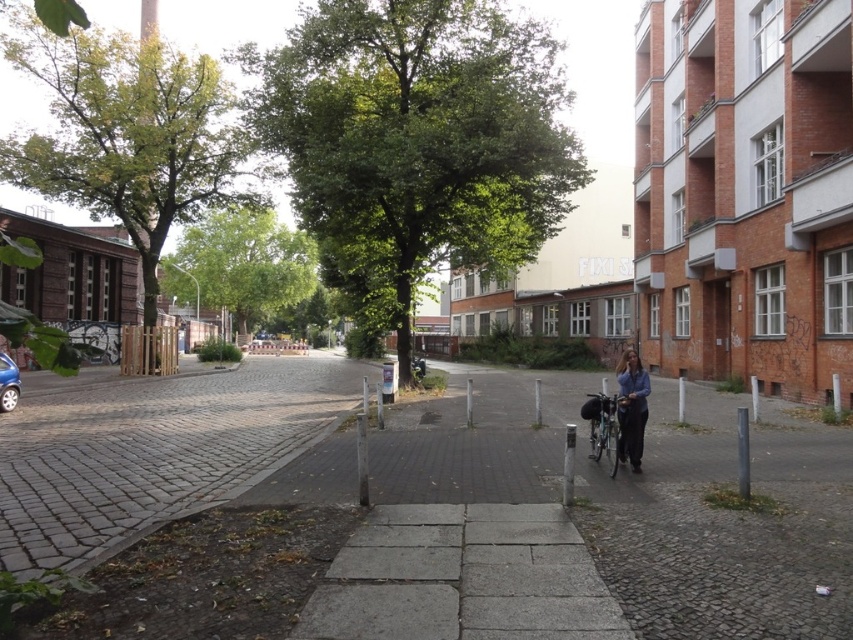
The image size is (853, 640). What do you see at coordinates (437, 506) in the screenshot? I see `gray concrete pavement at center` at bounding box center [437, 506].

Is gray concrete pavement at center smaller than blue denim jacket at lower right?

Incorrect, gray concrete pavement at center is not smaller in size than blue denim jacket at lower right.

Image resolution: width=853 pixels, height=640 pixels. I want to click on gray concrete pavement at center, so click(x=437, y=506).

Does gray concrete pavement at center have a greater height compared to shiny metallic bicycle at center?

In fact, gray concrete pavement at center may be shorter than shiny metallic bicycle at center.

Is point (399, 500) farther from viewer compared to point (610, 403)?

That is False.

I want to click on gray concrete pavement at center, so click(437, 506).

Where is `gray concrete pavement at center`? This screenshot has width=853, height=640. gray concrete pavement at center is located at coordinates (437, 506).

Who is more forward, (647, 381) or (614, 412)?

Point (614, 412)

I want to click on blue denim jacket at lower right, so click(631, 406).

What do you see at coordinates (631, 406) in the screenshot? I see `blue denim jacket at lower right` at bounding box center [631, 406].

The image size is (853, 640). Identify the location of blue denim jacket at lower right. (631, 406).